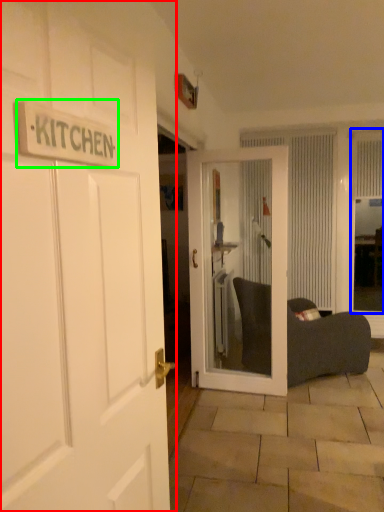
Question: Which is farther away from door (highlighted by a red box)? window screen (highlighted by a blue box) or sign (highlighted by a green box)?

Choices:
 (A) window screen
 (B) sign

Answer: (A)